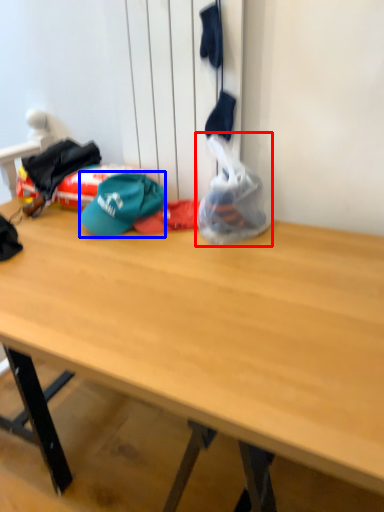
Question: Which of the following is the closest to the observer, plastic bag (highlighted by a red box) or hat (highlighted by a blue box)?

Choices:
 (A) plastic bag
 (B) hat

Answer: (A)